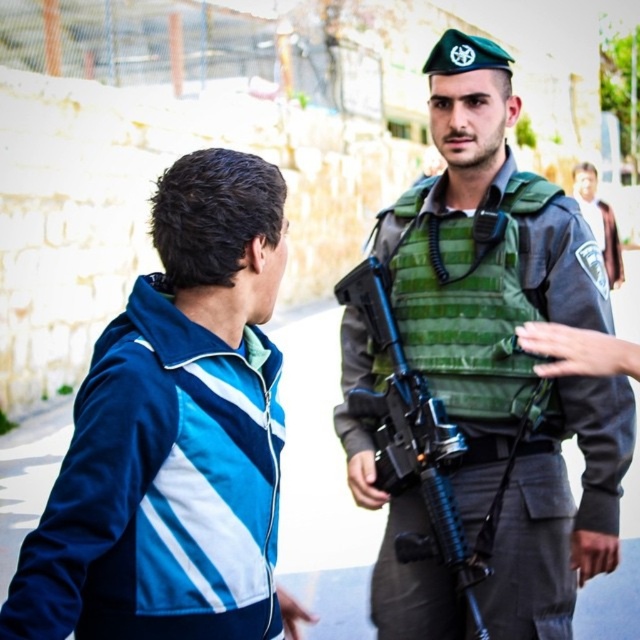
Question: Which object is closer to the camera taking this photo?

Choices:
 (A) green uniform at center
 (B) matte black rifle at center
 (C) green fabric vest at center
 (D) blue fabric jacket at upper left

Answer: (D)

Question: Is green fabric vest at center to the left of matte black rifle at center from the viewer's perspective?

Choices:
 (A) yes
 (B) no

Answer: (B)

Question: Which object appears closest to the camera in this image?

Choices:
 (A) blue fabric jacket at upper left
 (B) green fabric vest at center
 (C) green uniform at center

Answer: (A)

Question: Can you confirm if blue fabric jacket at upper left is positioned to the left of matte black rifle at center?

Choices:
 (A) no
 (B) yes

Answer: (B)

Question: Is matte black rifle at center wider than green uniform at center?

Choices:
 (A) no
 (B) yes

Answer: (A)

Question: Which point is farther to the camera?

Choices:
 (A) (520, 637)
 (B) (611, 212)
 (C) (211, 186)
 (D) (392, 428)

Answer: (B)